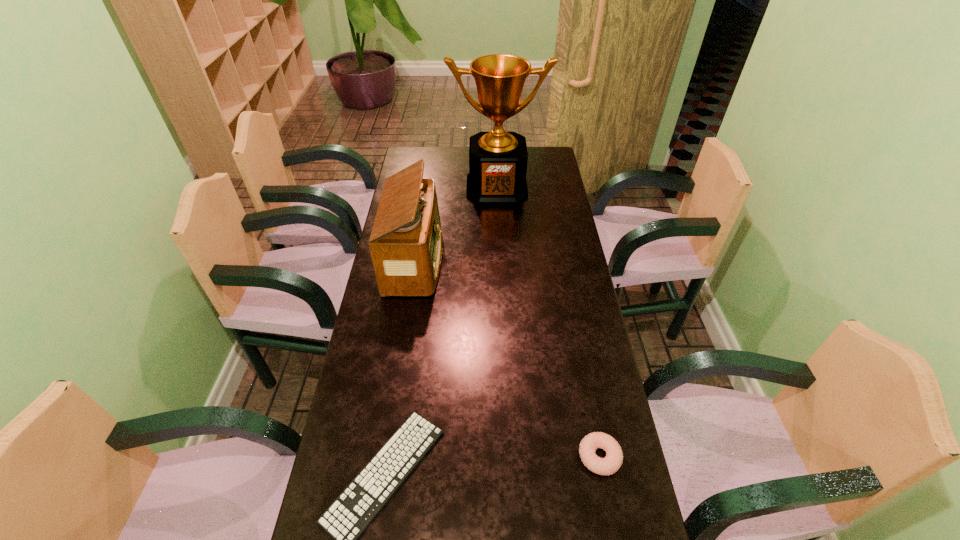
Identify the location of the closest object to the computer keyboard. This screenshot has width=960, height=540. (612, 462).

Where is `object that stands as the third closest to the second farthest object`? The width and height of the screenshot is (960, 540). object that stands as the third closest to the second farthest object is located at coordinates (612, 462).

Locate an element on the screen. The width and height of the screenshot is (960, 540). free space that satisfies the following two spatial constraints: 1. on the front panel of the third nearest object; 2. on the left side of the doughnut is located at coordinates (385, 456).